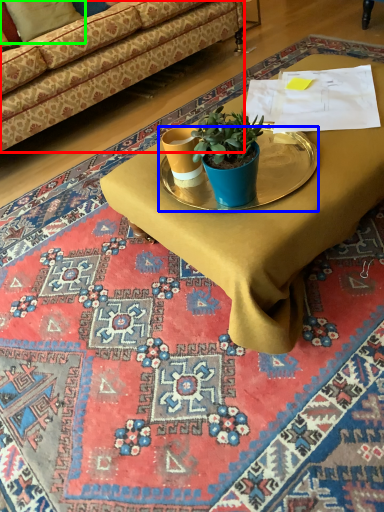
Question: Which is farther away from studio couch (highlighted by a red box)? round table (highlighted by a blue box) or pillow (highlighted by a green box)?

Choices:
 (A) round table
 (B) pillow

Answer: (A)